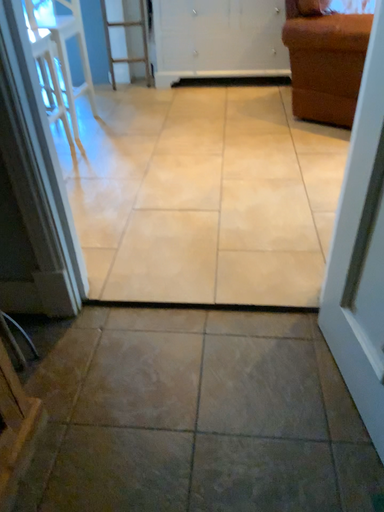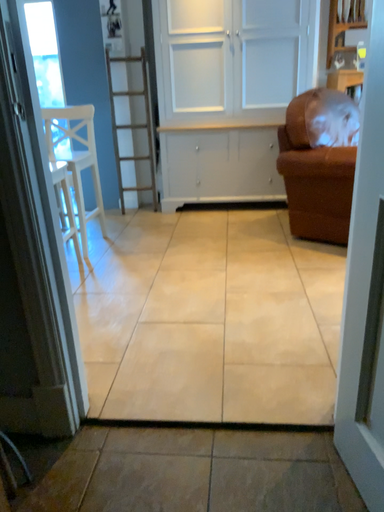
Question: How did the camera likely rotate when shooting the video?

Choices:
 (A) rotated upward
 (B) rotated downward

Answer: (A)